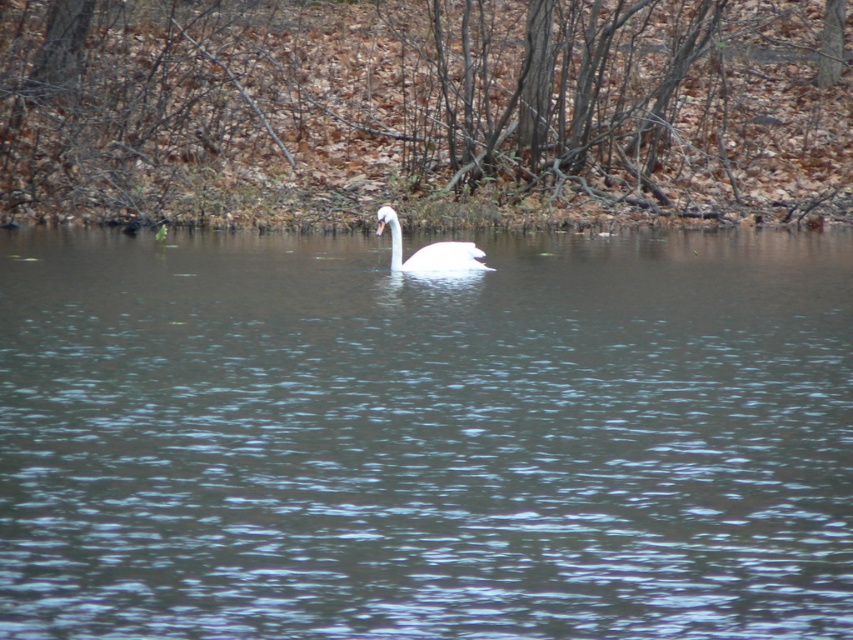
Which of these two, clear water at center or white glossy swan at center, stands taller?

Standing taller between the two is clear water at center.

Does point (613, 576) come closer to viewer compared to point (397, 240)?

Yes, it is in front of point (397, 240).

The width and height of the screenshot is (853, 640). I want to click on clear water at center, so click(x=425, y=436).